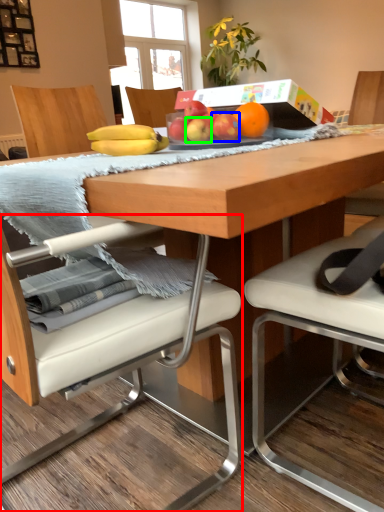
Question: Which object is the farthest from chair (highlighted by a red box)? Choose among these: apple (highlighted by a blue box) or apple (highlighted by a green box).

Choices:
 (A) apple
 (B) apple

Answer: (A)